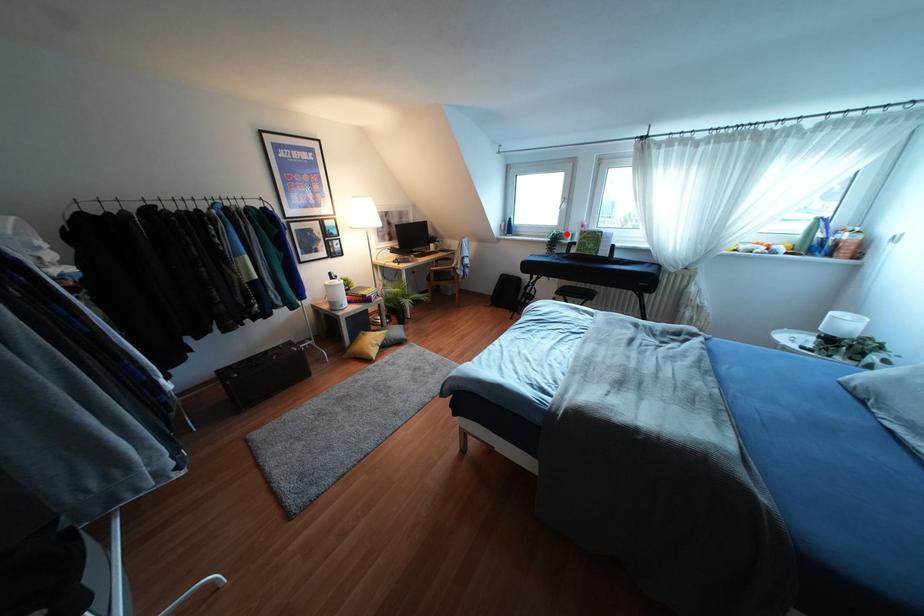
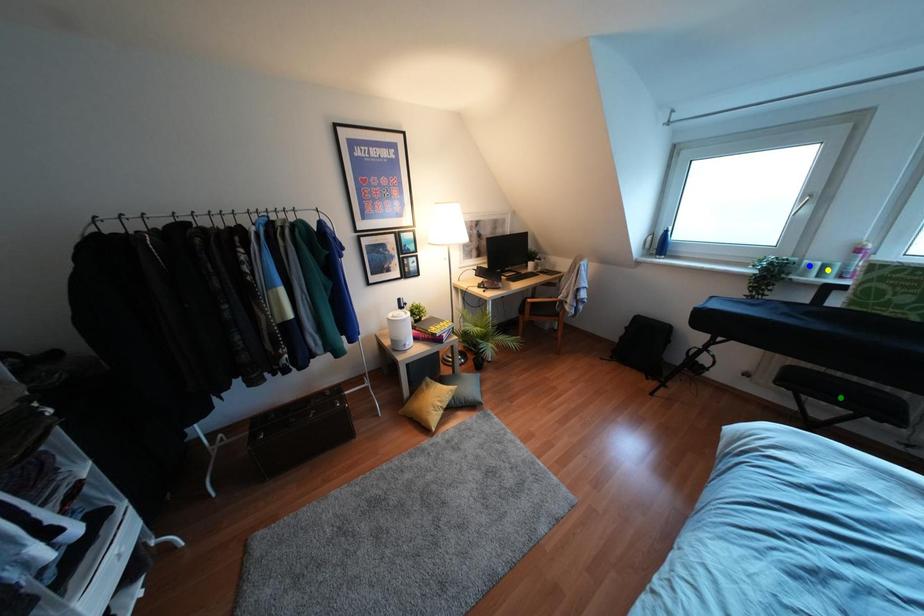
Question: I am providing you with two images of the same scene from different viewpoints. A red point is marked on the first image. You are given multiple points on the second image. In image 2, which mark is for the same physical point as the one in image 1?

Choices:
 (A) blue point
 (B) green point
 (C) yellow point

Answer: (A)